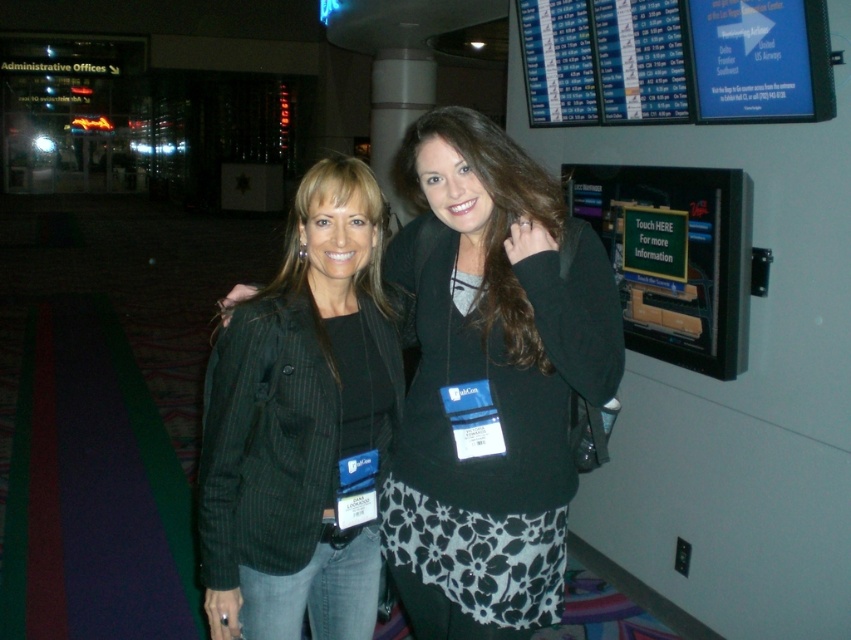
Who is shorter, black pinstripe blazer at center or green pinstripe blazer at center?

green pinstripe blazer at center

Between black pinstripe blazer at center and green pinstripe blazer at center, which one appears on the left side from the viewer's perspective?

Positioned to the left is green pinstripe blazer at center.

Does point (524, 477) come behind point (253, 353)?

Yes, point (524, 477) is behind point (253, 353).

At what (x,y) coordinates should I click in order to perform the action: click on black pinstripe blazer at center. Please return your answer as a coordinate pair (x, y). This screenshot has width=851, height=640. Looking at the image, I should click on (490, 381).